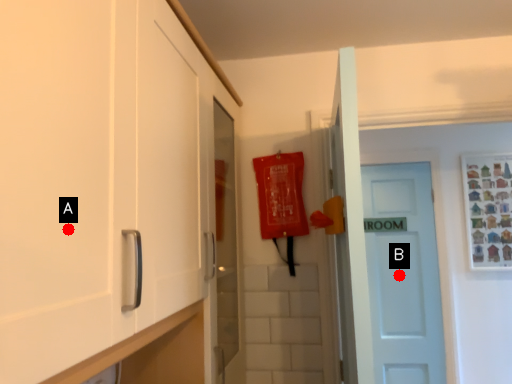
Question: Two points are circled on the image, labeled by A and B beside each circle. Which point is further to the camera?

Choices:
 (A) A is further
 (B) B is further

Answer: (B)